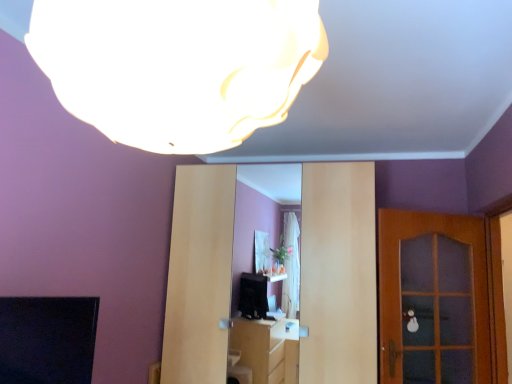
Question: Could you tell me if matte wood entertainment center at center is turned towards white matte lampshade at upper center?

Choices:
 (A) yes
 (B) no

Answer: (A)

Question: Could white matte lampshade at upper center be considered to be inside matte wood entertainment center at center?

Choices:
 (A) no
 (B) yes

Answer: (A)

Question: Is matte wood entertainment center at center taller than white matte lampshade at upper center?

Choices:
 (A) yes
 (B) no

Answer: (A)

Question: From a real-world perspective, is matte wood entertainment center at center located beneath white matte lampshade at upper center?

Choices:
 (A) no
 (B) yes

Answer: (B)

Question: Is matte wood entertainment center at center outside white matte lampshade at upper center?

Choices:
 (A) no
 (B) yes

Answer: (B)

Question: Do you think white matte lampshade at upper center is within wooden door at right, or outside of it?

Choices:
 (A) outside
 (B) inside

Answer: (A)

Question: Considering the positions of white matte lampshade at upper center and wooden door at right in the image, is white matte lampshade at upper center wider or thinner than wooden door at right?

Choices:
 (A) wide
 (B) thin

Answer: (A)

Question: Considering their positions, is white matte lampshade at upper center located in front of or behind wooden door at right?

Choices:
 (A) behind
 (B) front

Answer: (B)

Question: Based on their positions, is white matte lampshade at upper center located to the left or right of wooden door at right?

Choices:
 (A) right
 (B) left

Answer: (B)

Question: Based on their sizes in the image, would you say matte wood entertainment center at center is bigger or smaller than white matte lampshade at upper center?

Choices:
 (A) big
 (B) small

Answer: (A)

Question: Considering the positions of point (201, 337) and point (304, 3), is point (201, 337) closer or farther from the camera than point (304, 3)?

Choices:
 (A) closer
 (B) farther

Answer: (B)

Question: From the image's perspective, is matte wood entertainment center at center above or below white matte lampshade at upper center?

Choices:
 (A) above
 (B) below

Answer: (B)

Question: Would you say matte wood entertainment center at center is inside or outside white matte lampshade at upper center?

Choices:
 (A) inside
 (B) outside

Answer: (B)

Question: In the image, is white matte lampshade at upper center positioned in front of or behind matte wood entertainment center at center?

Choices:
 (A) front
 (B) behind

Answer: (A)

Question: Considering the positions of white matte lampshade at upper center and matte wood entertainment center at center in the image, is white matte lampshade at upper center bigger or smaller than matte wood entertainment center at center?

Choices:
 (A) big
 (B) small

Answer: (B)